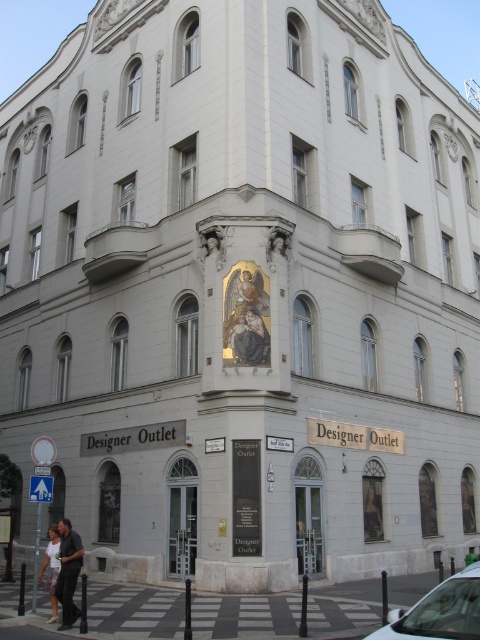
Question: Does dark gray pants at lower left have a smaller size compared to light pink fabric pants at lower left?

Choices:
 (A) yes
 (B) no

Answer: (A)

Question: Which of the following is the closest to the observer?

Choices:
 (A) dark gray pants at lower left
 (B) light pink fabric pants at lower left

Answer: (A)

Question: Does dark gray pants at lower left lie in front of light pink fabric pants at lower left?

Choices:
 (A) yes
 (B) no

Answer: (A)

Question: Is dark gray pants at lower left further to camera compared to light pink fabric pants at lower left?

Choices:
 (A) yes
 (B) no

Answer: (B)